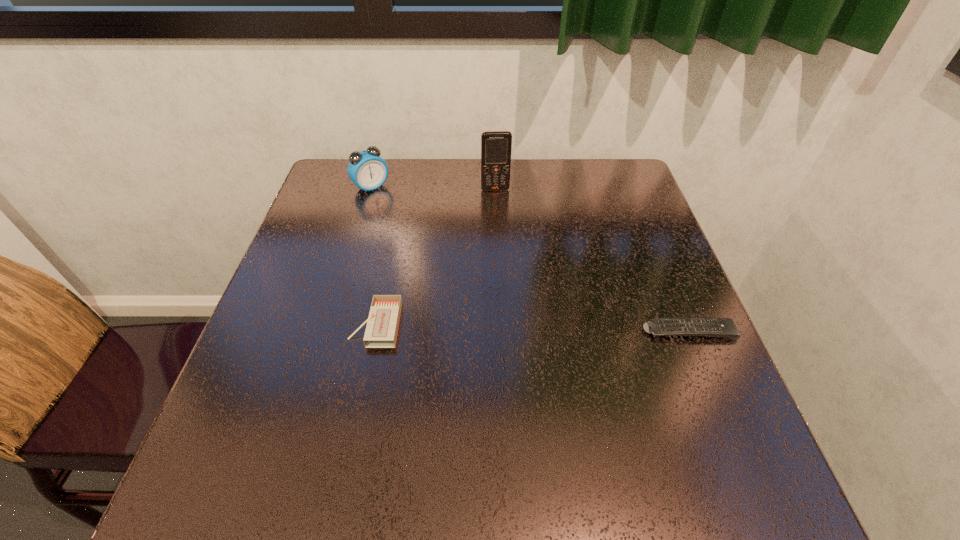
Where is `object present at the far left corner`? object present at the far left corner is located at coordinates (368, 171).

In order to click on vacant space at the far edge of the desktop in this screenshot , I will do `click(458, 184)`.

This screenshot has height=540, width=960. I want to click on vacant space at the near edge, so click(502, 410).

The width and height of the screenshot is (960, 540). I want to click on vacant area at the left edge of the desktop, so click(x=297, y=261).

In the image, there is a desktop. In order to click on vacant space at the right edge in this screenshot , I will do `click(636, 232)`.

The width and height of the screenshot is (960, 540). What are the coordinates of `blank space at the near left corner of the desktop` in the screenshot? It's located at (267, 437).

At what (x,y) coordinates should I click in order to perform the action: click on free region at the far right corner. Please return your answer as a coordinate pair (x, y). This screenshot has width=960, height=540. Looking at the image, I should click on (576, 160).

I want to click on free location at the near right corner, so click(722, 393).

Locate an element on the screen. The image size is (960, 540). free space that is in between the alarm clock and the rightmost object is located at coordinates (530, 259).

The height and width of the screenshot is (540, 960). Find the location of `free space between the third object from left to right and the shortest object`. free space between the third object from left to right and the shortest object is located at coordinates (591, 260).